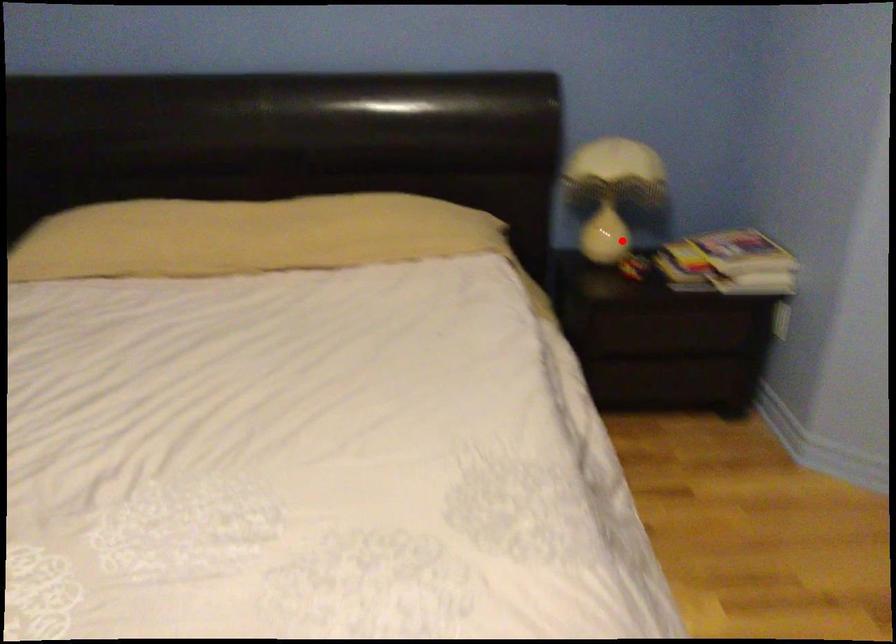
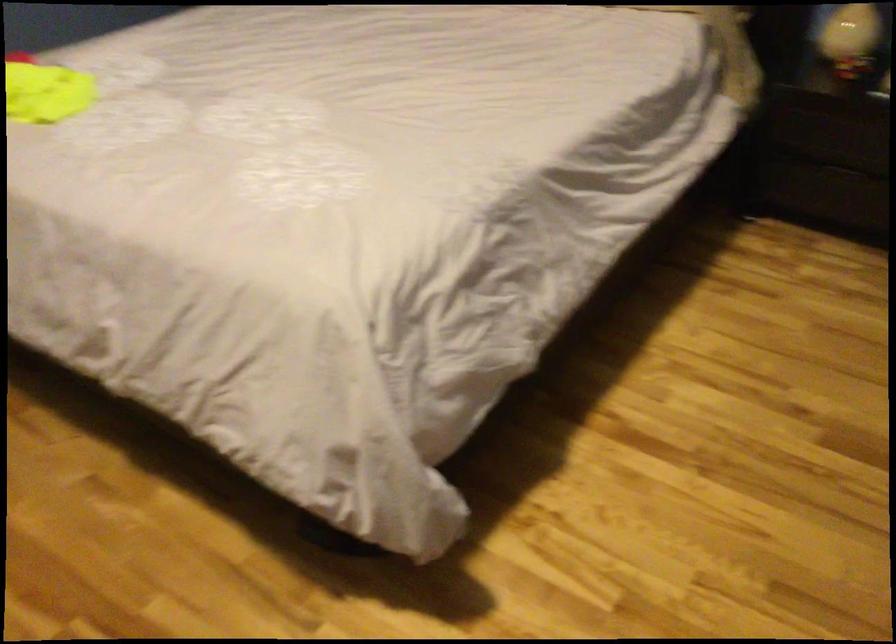
Locate, in the second image, the point that corresponds to the highlighted location in the first image.

(851, 39)